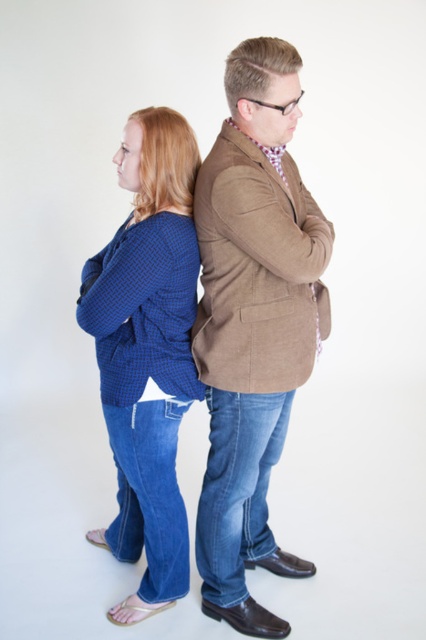
Which is below, blue checkered shirt at center or blue checkered sweater at center?

Positioned lower is blue checkered sweater at center.

Does point (230, 461) lie in front of point (120, 422)?

No.

Where is `blue checkered shirt at center`? The width and height of the screenshot is (426, 640). blue checkered shirt at center is located at coordinates (253, 323).

Measure the distance from blue checkered sweater at center to matte brown blazer at center.

The distance of blue checkered sweater at center from matte brown blazer at center is 8.79 inches.

Does blue checkered sweater at center have a lesser height compared to matte brown blazer at center?

In fact, blue checkered sweater at center may be taller than matte brown blazer at center.

Between point (193, 300) and point (267, 388), which one is positioned in front?

Point (267, 388) is more forward.

You are a GUI agent. You are given a task and a screenshot of the screen. Output one action in this format:
    pyautogui.click(x=<x>, y=<y>)
    Task: Click on the blue checkered sweater at center
    This screenshot has height=640, width=426.
    Given the screenshot: What is the action you would take?
    pyautogui.click(x=146, y=352)

Does blue checkered shirt at center have a larger size compared to matte brown blazer at center?

Correct, blue checkered shirt at center is larger in size than matte brown blazer at center.

Where is `blue checkered shirt at center`? Image resolution: width=426 pixels, height=640 pixels. blue checkered shirt at center is located at coordinates (253, 323).